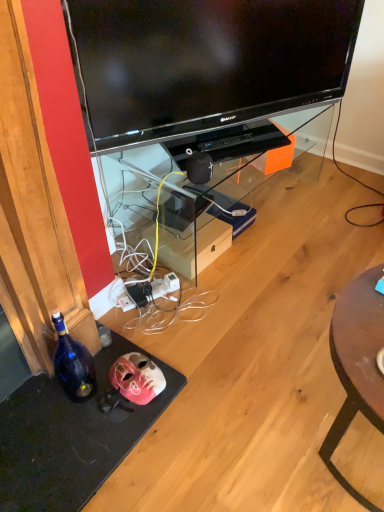
Question: In which direction should I rotate to look at transparent glass entertainment center at center?

Choices:
 (A) left
 (B) right

Answer: (B)